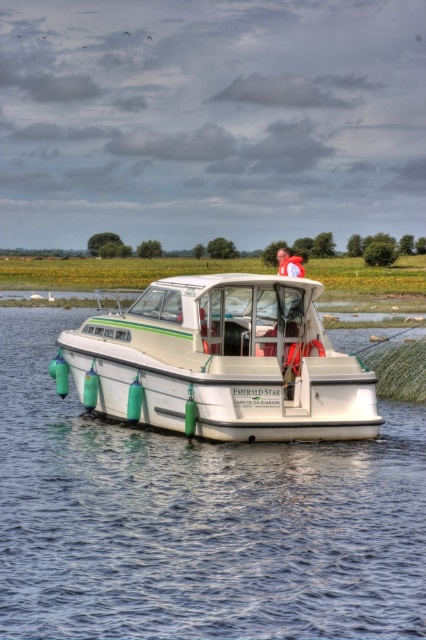
You are standing on the dock and looking at the white glossy water at center and the light blue fabric shirt at center. Which object is taller?

The light blue fabric shirt at center is taller than the white glossy water at center.

You are standing on the dock and see the white glossy boat at center and the light blue fabric shirt at center. Which object is positioned to the left?

The white glossy boat at center is to the left of the light blue fabric shirt at center.